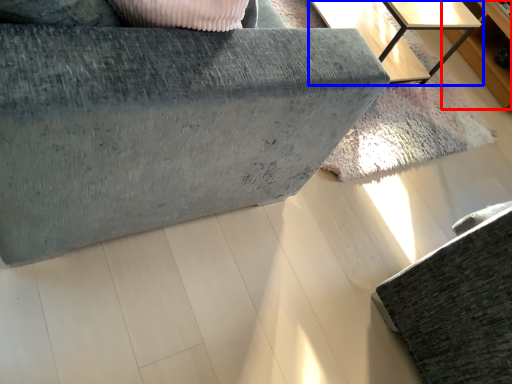
Question: Which point is further to the camera, dresser (highlighted by a red box) or table (highlighted by a blue box)?

Choices:
 (A) dresser
 (B) table

Answer: (A)